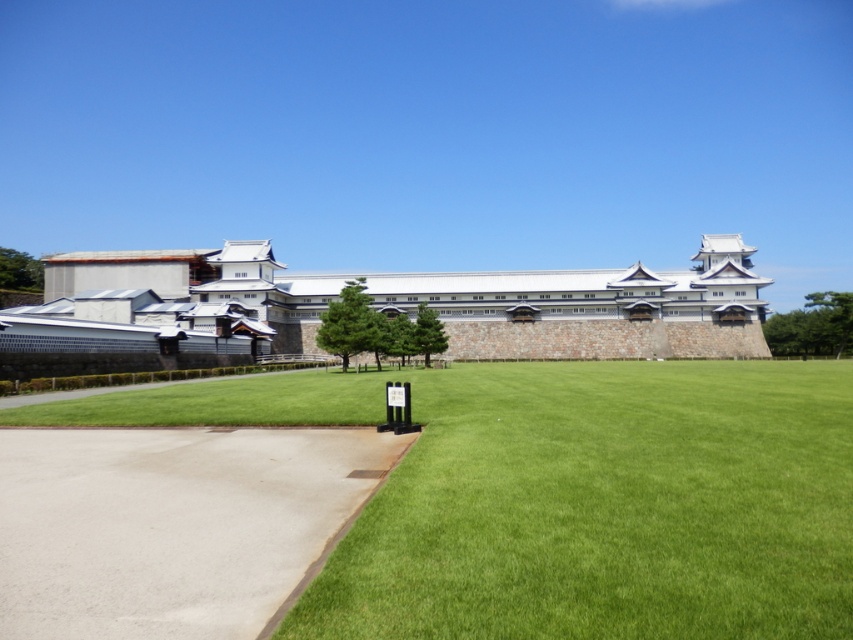
You are a gardener planning to mow the green grass at center and white stone wall at center. Which area requires a wider mower path to cover its entire width?

The white stone wall at center requires a wider mower path since the green grass at center has a smaller width compared to the white stone wall at center according to the description.